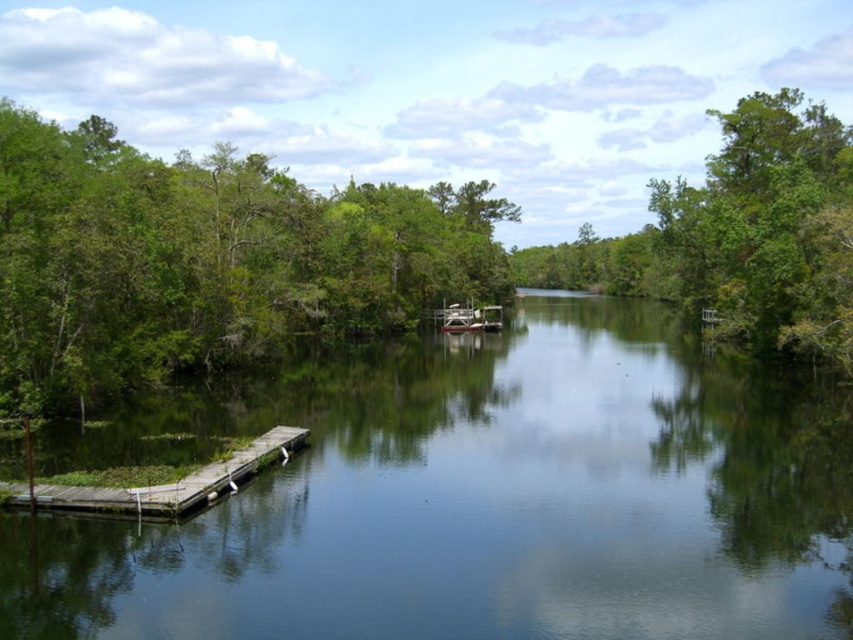
Question: Does green leafy tree at upper right have a larger size compared to wooden dock at left?

Choices:
 (A) yes
 (B) no

Answer: (A)

Question: Which of the following is the closest to the observer?

Choices:
 (A) green smooth water at center
 (B) wooden dock at left
 (C) white plastic boat at center

Answer: (A)

Question: Is green smooth water at center thinner than white plastic boat at center?

Choices:
 (A) yes
 (B) no

Answer: (B)

Question: Which object appears closest to the camera in this image?

Choices:
 (A) wooden dock at left
 (B) green smooth water at center

Answer: (B)

Question: From the image, what is the correct spatial relationship of green smooth water at center in relation to green leafy tree at upper right?

Choices:
 (A) left
 (B) right

Answer: (A)

Question: Estimate the real-world distances between objects in this image. Which object is closer to the green leafy tree at upper right?

Choices:
 (A) green smooth water at center
 (B) wooden dock at left
 (C) white plastic boat at center

Answer: (A)